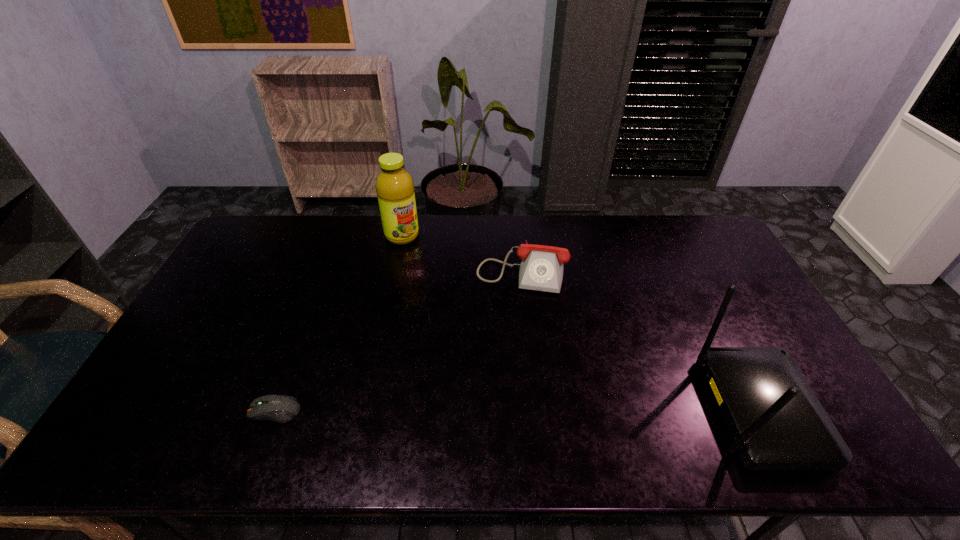
Identify the location of vacant point that satisfies the following two spatial constraints: 1. on the front side of the third object from right to left; 2. on the front-facing side of the rightmost object. The image size is (960, 540). click(365, 411).